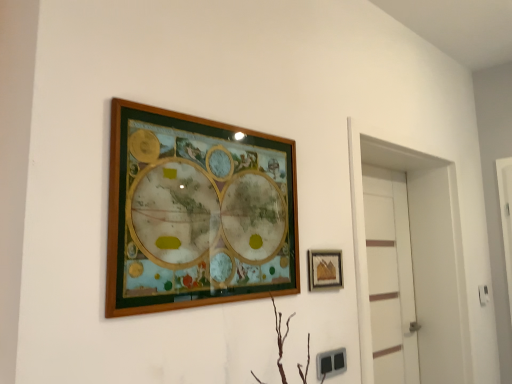
Question: Is white matte door at right further to camera compared to matte gold picture frame at right, arranged as the first picture frame when viewed from the right?

Choices:
 (A) no
 (B) yes

Answer: (B)

Question: Considering the relative positions of white matte door at right and matte gold picture frame at right, arranged as the 1th picture frame when viewed from the back, in the image provided, is white matte door at right to the left of matte gold picture frame at right, arranged as the 1th picture frame when viewed from the back, from the viewer's perspective?

Choices:
 (A) yes
 (B) no

Answer: (B)

Question: Does white matte door at right have a lesser width compared to matte gold picture frame at right, arranged as the 1th picture frame when viewed from the back?

Choices:
 (A) yes
 (B) no

Answer: (B)

Question: Is white matte door at right smaller than matte gold picture frame at right, arranged as the first picture frame when viewed from the right?

Choices:
 (A) no
 (B) yes

Answer: (A)

Question: Is white matte door at right at the right side of matte gold picture frame at right, arranged as the first picture frame when viewed from the right?

Choices:
 (A) no
 (B) yes

Answer: (B)

Question: Is white matte door at right placed right next to matte gold picture frame at right, arranged as the 2th picture frame when viewed from the left?

Choices:
 (A) yes
 (B) no

Answer: (B)

Question: Is white matte door at right thinner than white glossy door at right?

Choices:
 (A) no
 (B) yes

Answer: (B)

Question: From the image's perspective, is white matte door at right located beneath white glossy door at right?

Choices:
 (A) yes
 (B) no

Answer: (A)

Question: Is white matte door at right placed right next to white glossy door at right?

Choices:
 (A) yes
 (B) no

Answer: (B)

Question: From a real-world perspective, is white matte door at right beneath white glossy door at right?

Choices:
 (A) no
 (B) yes

Answer: (B)

Question: From a real-world perspective, is white matte door at right over white glossy door at right?

Choices:
 (A) yes
 (B) no

Answer: (B)

Question: Is white matte door at right smaller than white glossy door at right?

Choices:
 (A) yes
 (B) no

Answer: (A)

Question: Does wooden picture frame at upper center, which is the 2th picture frame in right-to-left order, contain white matte door at right?

Choices:
 (A) no
 (B) yes

Answer: (A)